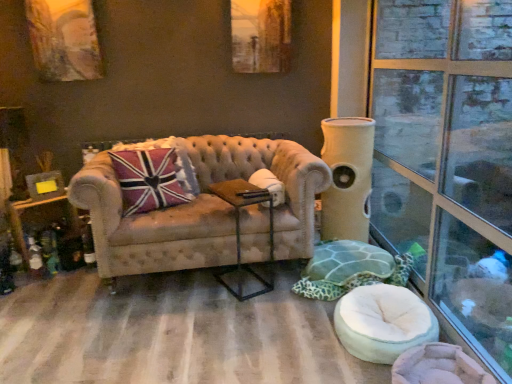
Locate an element on the screen. vacant region to the left of white fabric swivel chair at lower right, which is the 1th swivel chair from front to back is located at coordinates (302, 337).